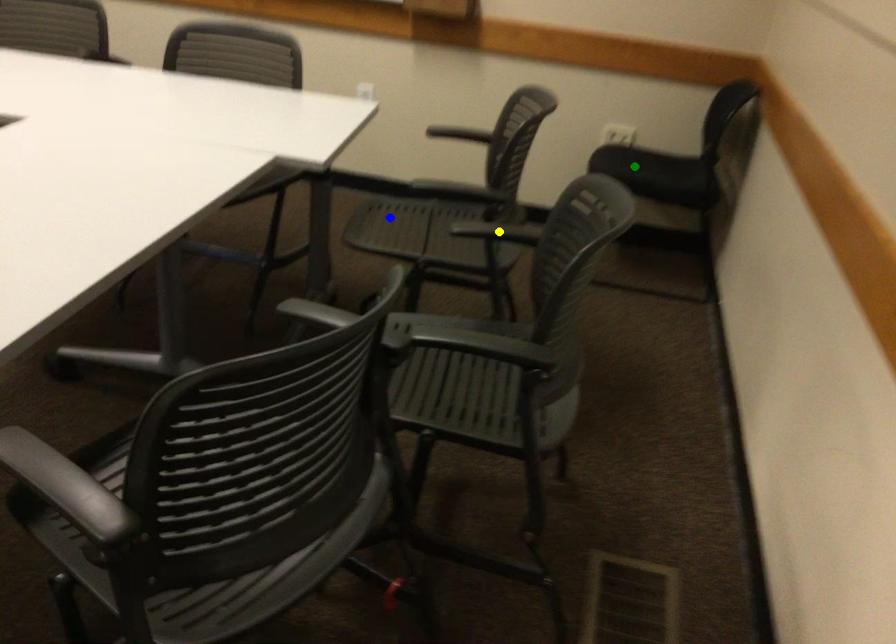
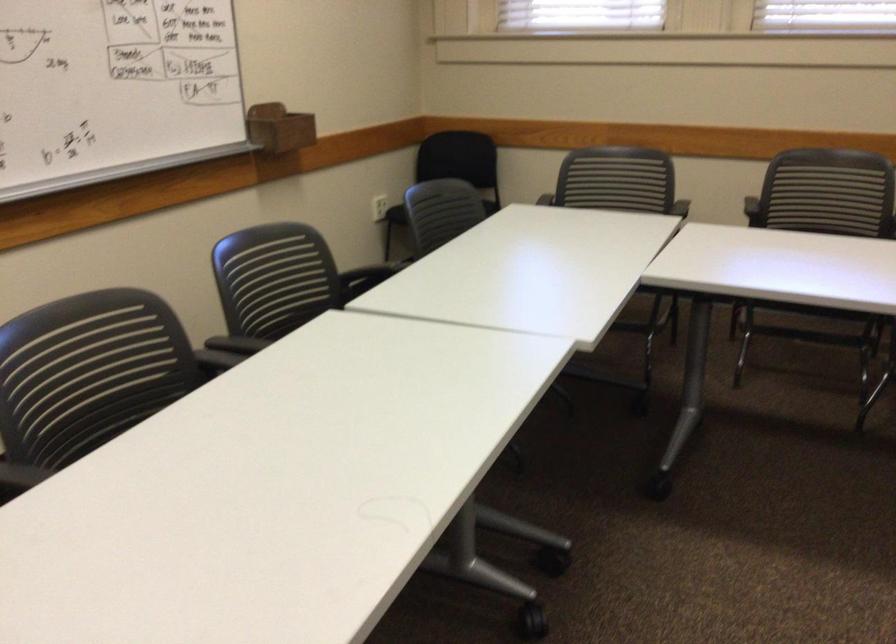
I am providing you with two images of the same scene from different viewpoints. Three points are marked in image1. Which point corresponds to a part or object that is occluded in image2?In image1, three points are marked. Which of them correspond to a part or object that is occluded in image2?Among the three points shown in image1, which one corresponds to a part or object that is no longer visible due to occlusion in image2?

yellow point, green point, blue point